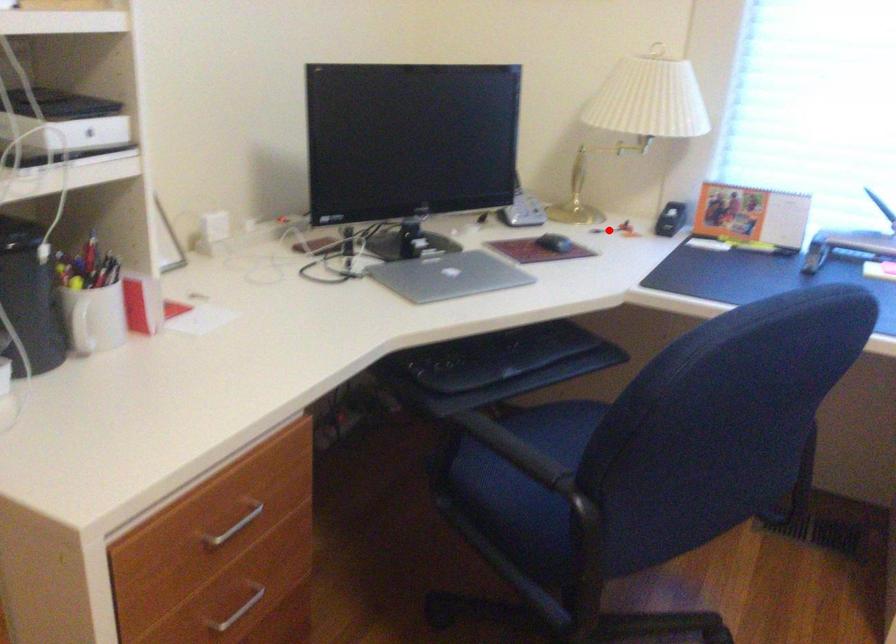
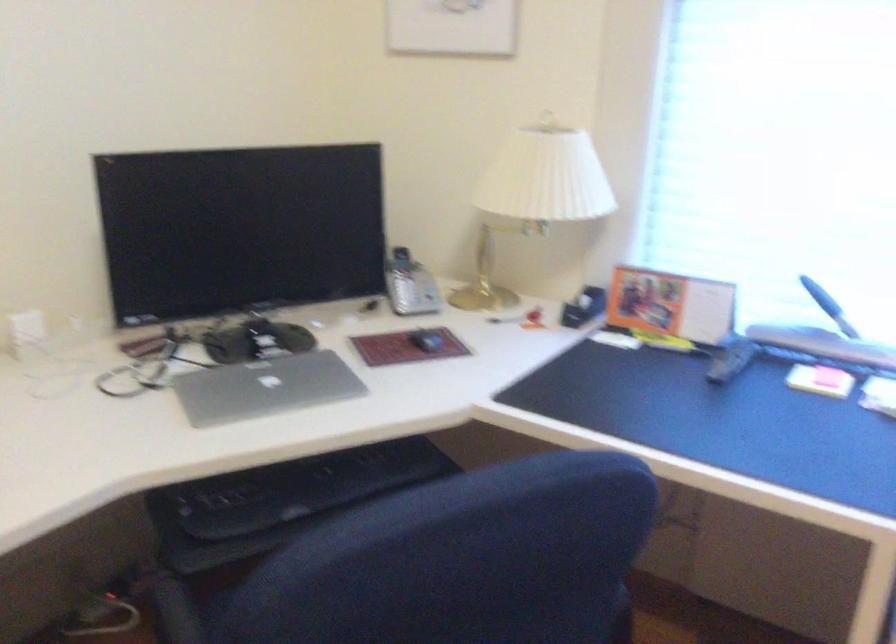
Locate, in the second image, the point that corresponds to the highlighted location in the first image.

(504, 319)